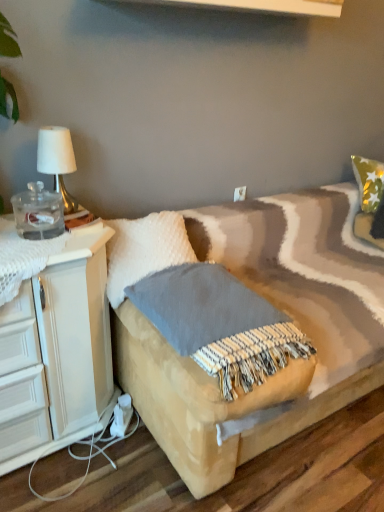
Question: Is white fluffy pillow at center closer to camera compared to gold metallic table lamp at upper left?

Choices:
 (A) no
 (B) yes

Answer: (B)

Question: Can you confirm if white fluffy pillow at center is taller than gold metallic table lamp at upper left?

Choices:
 (A) no
 (B) yes

Answer: (B)

Question: Would you consider white fluffy pillow at center to be distant from gold metallic table lamp at upper left?

Choices:
 (A) yes
 (B) no

Answer: (B)

Question: Is white fluffy pillow at center thinner than gold metallic table lamp at upper left?

Choices:
 (A) no
 (B) yes

Answer: (A)

Question: Is white fluffy pillow at center shorter than gold metallic table lamp at upper left?

Choices:
 (A) yes
 (B) no

Answer: (B)

Question: Does white fluffy pillow at center come behind gold metallic table lamp at upper left?

Choices:
 (A) no
 (B) yes

Answer: (A)

Question: Can you confirm if white plastic electric outlet at upper center is positioned to the left of textured beige blanket at center?

Choices:
 (A) yes
 (B) no

Answer: (B)

Question: Can you confirm if white plastic electric outlet at upper center is wider than textured beige blanket at center?

Choices:
 (A) yes
 (B) no

Answer: (B)

Question: From a real-world perspective, is white plastic electric outlet at upper center physically below textured beige blanket at center?

Choices:
 (A) yes
 (B) no

Answer: (B)

Question: Is white plastic electric outlet at upper center located outside textured beige blanket at center?

Choices:
 (A) yes
 (B) no

Answer: (A)

Question: From a real-world perspective, is white plastic electric outlet at upper center located higher than textured beige blanket at center?

Choices:
 (A) yes
 (B) no

Answer: (A)

Question: Does white plastic electric outlet at upper center have a lesser height compared to textured beige blanket at center?

Choices:
 (A) no
 (B) yes

Answer: (B)

Question: From a real-world perspective, is white plastic electric outlet at upper center located beneath white fluffy pillow at center?

Choices:
 (A) yes
 (B) no

Answer: (B)